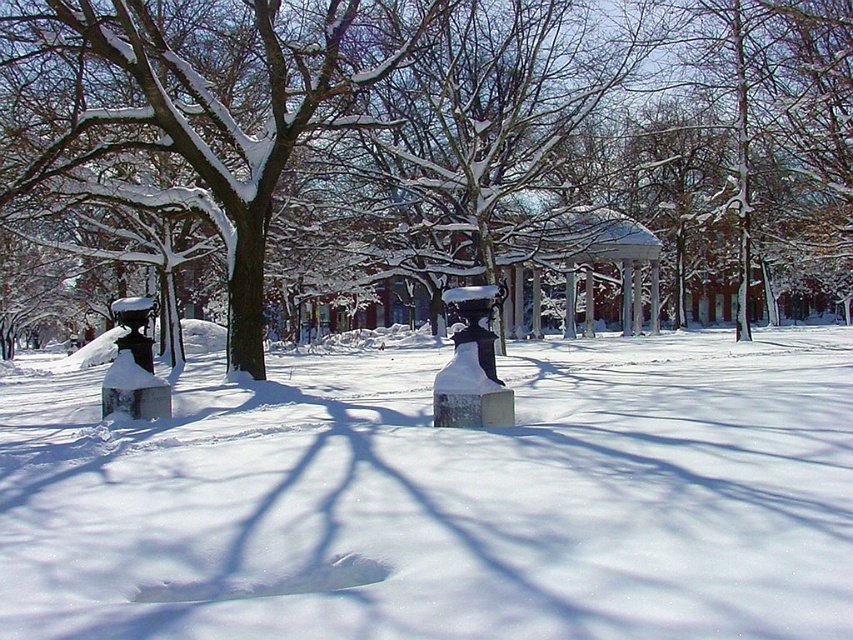
You are standing at the edge of the park and want to place a small snowman exactly where the white matte snow at center is located. Given that the park is a coordinate grid with the bottom left corner as the origin, can you confirm the exact coordinates where you should build the snowman?

The white matte snow at center is located at coordinates point [444,499], so you should build the snowman there.